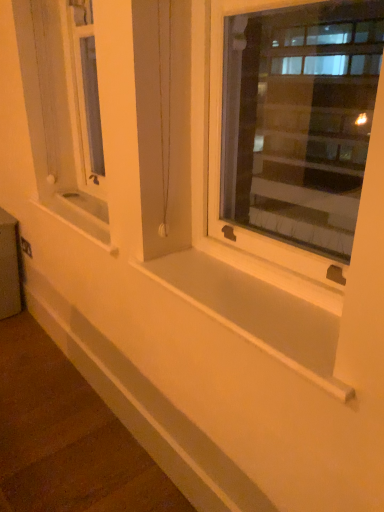
The height and width of the screenshot is (512, 384). I want to click on empty space that is ontop of white smooth window sill at center, marked as the first window sill in a right-to-left arrangement (from a real-world perspective), so click(265, 304).